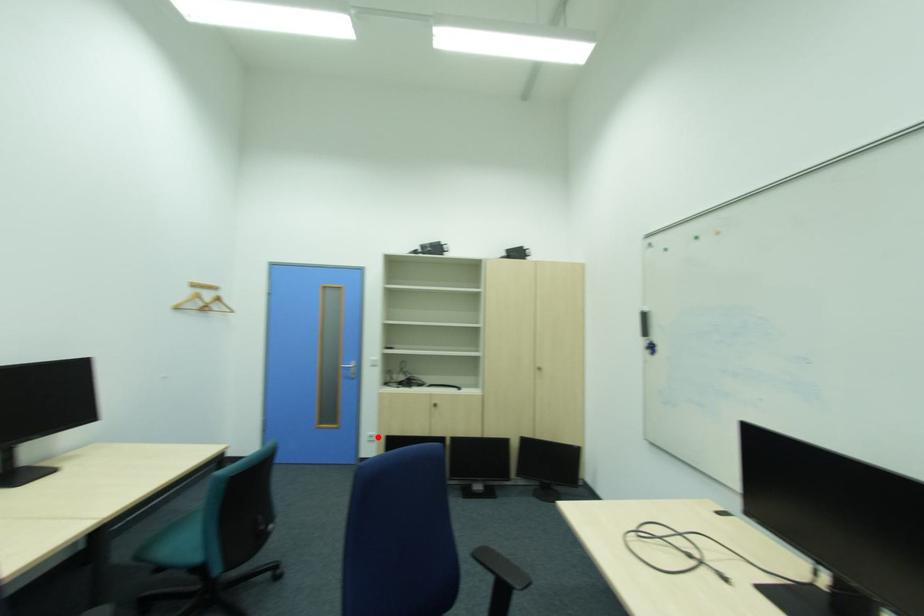
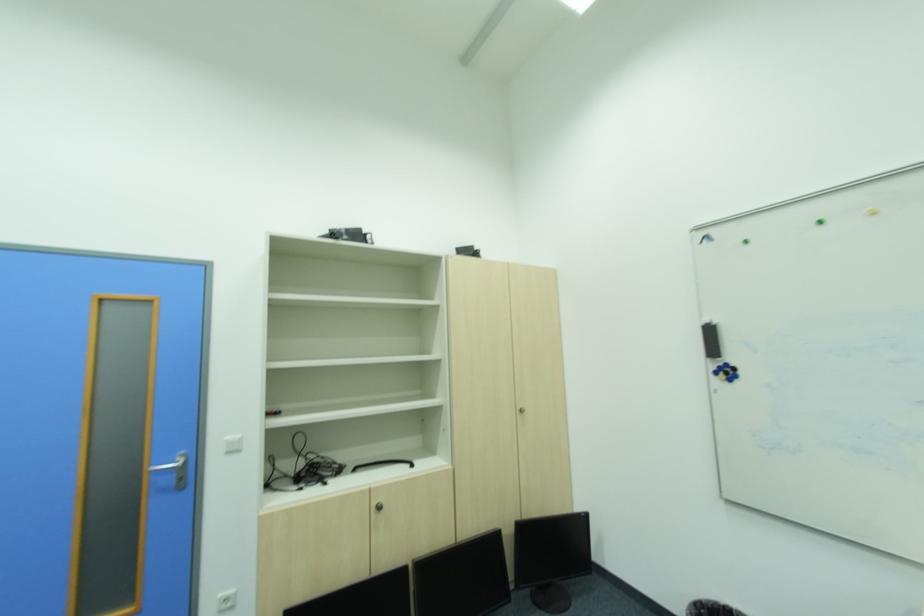
Question: I am providing you with two images of the same scene from different viewpoints. Given a red point in image1, look at the same physical point in image2. Is it:

Choices:
 (A) Closer to the viewpoint
 (B) Farther from the viewpoint

Answer: (A)